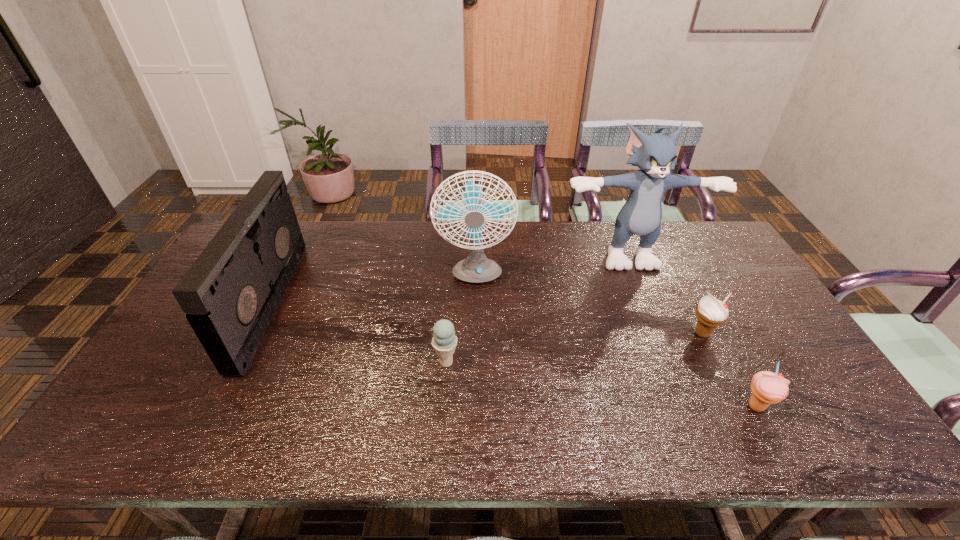
Identify the location of vacant space at the far edge of the desktop. (519, 234).

Where is `vacant region at the near edge`? vacant region at the near edge is located at coordinates (408, 416).

Image resolution: width=960 pixels, height=540 pixels. Find the location of `free region at the left edge`. free region at the left edge is located at coordinates (156, 383).

I want to click on empty space between the fourth shortest object and the cat, so click(x=447, y=276).

Locate an element on the screen. free area in between the leftmost icecream and the farthest icecream is located at coordinates (574, 348).

In order to click on free spot between the nearest object and the fan in this screenshot , I will do `click(615, 342)`.

Identify the location of vacant area that lies between the farthest icecream and the fan. (588, 306).

Identify the location of vacant space that is in between the cat and the farthest icecream. (663, 292).

You are a GUI agent. You are given a task and a screenshot of the screen. Output one action in this format:
    pyautogui.click(x=<x>, y=<y>)
    Task: Click on the unoccupied position between the fan and the third tallest object
    The width and height of the screenshot is (960, 540).
    Given the screenshot: What is the action you would take?
    pyautogui.click(x=372, y=291)

Find the location of `unoccupied position between the second farthest icecream and the fourth shortest object`. unoccupied position between the second farthest icecream and the fourth shortest object is located at coordinates (358, 333).